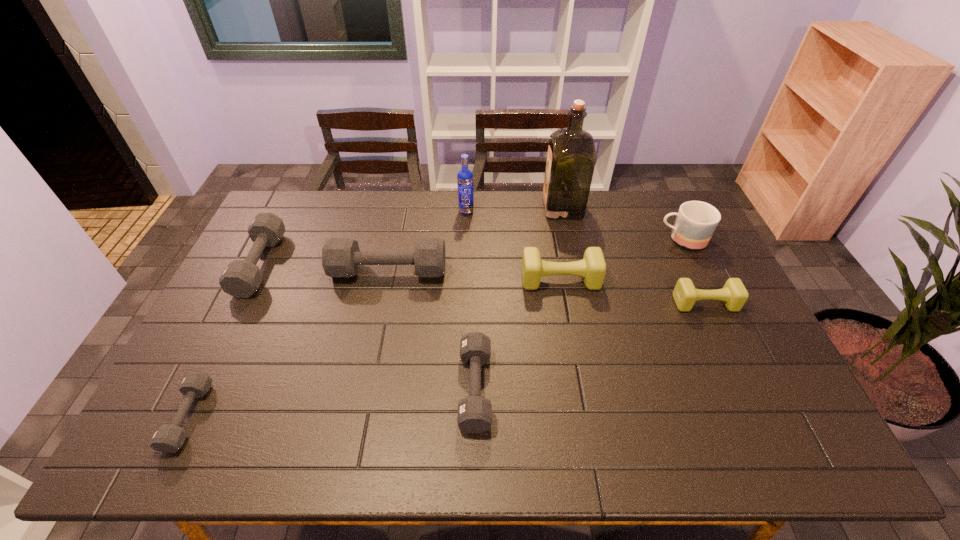
Find the location of a particular element. This screenshot has height=540, width=960. liquor is located at coordinates (571, 157).

Locate an element on the screen. vodka is located at coordinates (465, 176).

Locate an element on the screen. the second tallest object is located at coordinates (465, 176).

Find the location of `the seventh object from right to left`. the seventh object from right to left is located at coordinates (341, 257).

Locate an element on the screen. the third dumbbell from left to right is located at coordinates (341, 257).

Where is `blue mug`? The image size is (960, 540). blue mug is located at coordinates (696, 221).

Where is `the bigger olive dumbbell`? Image resolution: width=960 pixels, height=540 pixels. the bigger olive dumbbell is located at coordinates (592, 267).

The image size is (960, 540). Identify the location of the fifth dumbbell from left to right. (592, 267).

The height and width of the screenshot is (540, 960). Identify the location of the third smallest gray dumbbell. pyautogui.click(x=241, y=278).

The height and width of the screenshot is (540, 960). I want to click on the third biggest gray dumbbell, so click(474, 415).